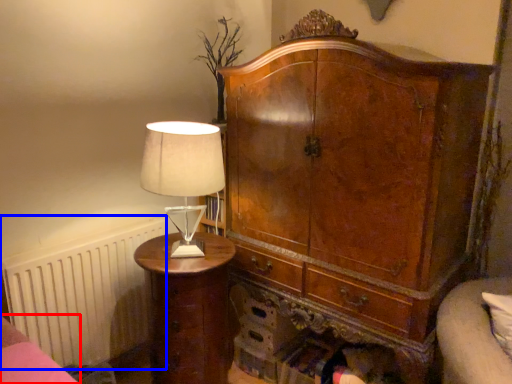
Question: Which point is closer to the camera, bed frame (highlighted by a red box) or radiator (highlighted by a blue box)?

Choices:
 (A) bed frame
 (B) radiator

Answer: (A)